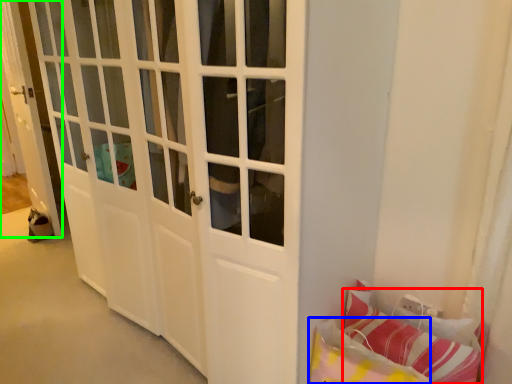
Question: Based on their relative distances, which object is nearer to pillow (highlighted by a red box)? Choose from pillow (highlighted by a blue box) and door (highlighted by a green box).

Choices:
 (A) pillow
 (B) door

Answer: (A)